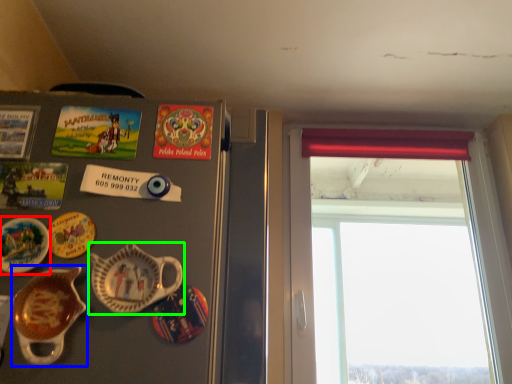
Question: Which is nearer to the plate (highlighted by a red box)? tableware (highlighted by a blue box) or tableware (highlighted by a green box).

Choices:
 (A) tableware
 (B) tableware

Answer: (A)